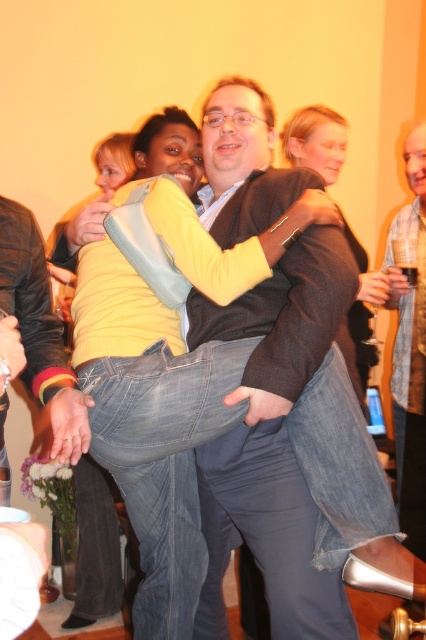
Question: Based on their relative distances, which object is nearer to the plaid shirt at center?

Choices:
 (A) matte brown jacket at upper right
 (B) matte brown sweater at center
 (C) denim jeans at center

Answer: (A)

Question: Observing the image, what is the correct spatial positioning of plaid shirt at center in reference to matte brown jacket at upper right?

Choices:
 (A) below
 (B) above

Answer: (A)

Question: Which point appears closest to the camera in this image?

Choices:
 (A) (150, 147)
 (B) (284, 419)

Answer: (B)

Question: Does matte brown sweater at center have a greater width compared to matte brown jacket at upper right?

Choices:
 (A) yes
 (B) no

Answer: (A)

Question: Considering the real-world distances, which object is farthest from the denim jeans at center?

Choices:
 (A) plaid shirt at center
 (B) matte brown sweater at center
 (C) matte brown jacket at upper right

Answer: (A)

Question: Is matte brown sweater at center above plaid shirt at center?

Choices:
 (A) no
 (B) yes

Answer: (A)